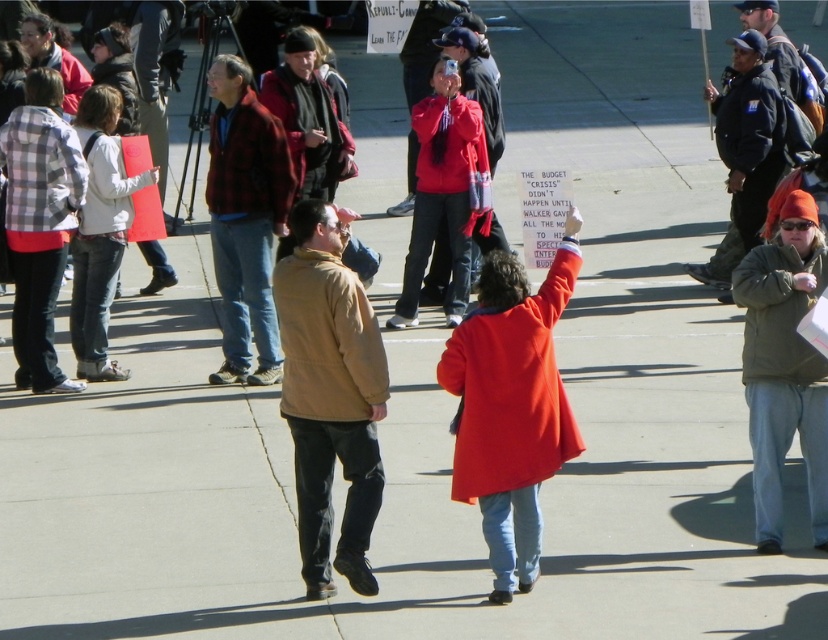
Who is positioned more to the left, matte red coat at center or brown matte jacket at center?

Positioned to the left is brown matte jacket at center.

Is matte red coat at center behind brown matte jacket at center?

Yes.

Does point (526, 314) come behind point (369, 352)?

Yes, it is behind point (369, 352).

In order to click on matte red coat at center in this screenshot , I will do `click(511, 404)`.

Image resolution: width=828 pixels, height=640 pixels. Describe the element at coordinates (39, 224) in the screenshot. I see `plaid flannel shirt at left` at that location.

Is point (47, 68) farther from viewer compared to point (416, 131)?

No, it is not.

Image resolution: width=828 pixels, height=640 pixels. Find the location of `plaid flannel shirt at left`. plaid flannel shirt at left is located at coordinates (39, 224).

Does plaid flannel shirt at left appear on the right side of white matte jacket at left?

No, plaid flannel shirt at left is not to the right of white matte jacket at left.

Does plaid flannel shirt at left appear under white matte jacket at left?

Incorrect, plaid flannel shirt at left is not positioned below white matte jacket at left.

At what (x,y) coordinates should I click in order to perform the action: click on plaid flannel shirt at left. Please return your answer as a coordinate pair (x, y). Looking at the image, I should click on (39, 224).

The image size is (828, 640). Find the location of `plaid flannel shirt at left`. plaid flannel shirt at left is located at coordinates (39, 224).